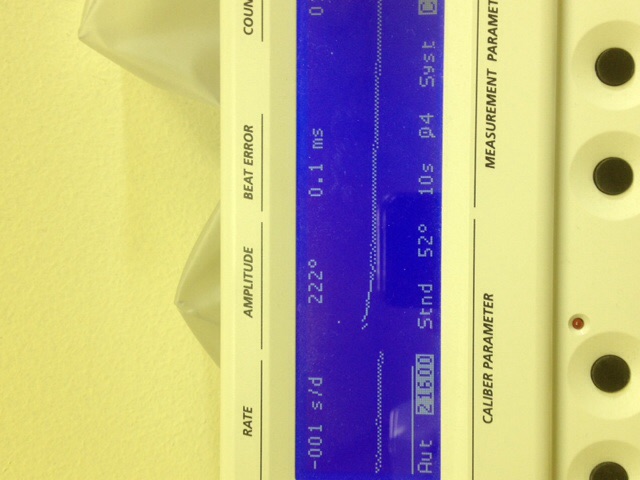
The image size is (640, 480). Identify the location of screen. (339, 263).